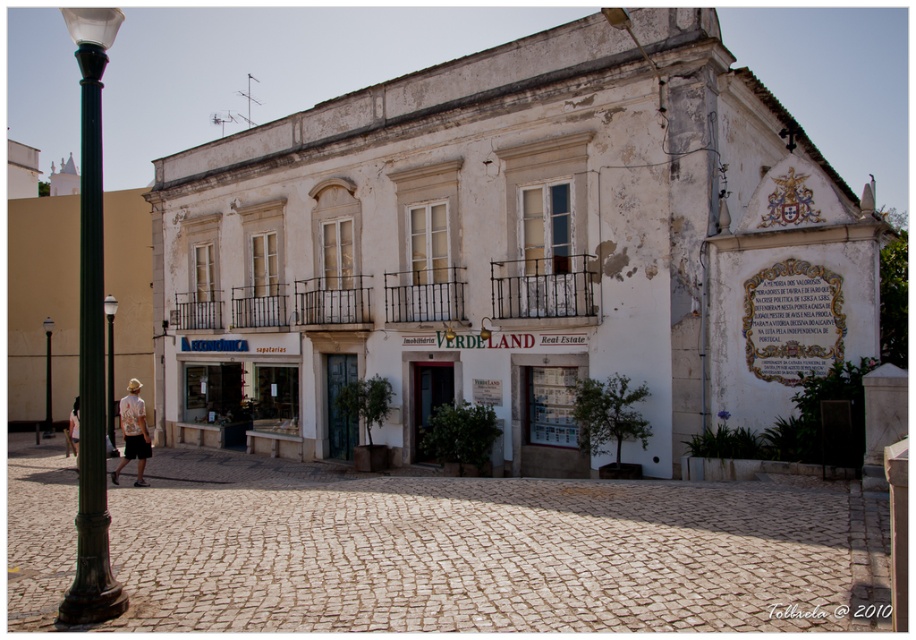
You are a tourist standing in front of the old building and notice two structures at the left side. One is the black glass lamp post at left and the other is the metallic pole at left. Which one is above the other?

The black glass lamp post at left is positioned over the metallic pole at left, so it is above the metallic pole at left.

You are a delivery person trying to secure a package on your bicycle. The package is too tall to fit under the black glass lamp post at left and the metallic pole at left. Which object would you need to avoid hitting your head on when passing underneath?

The black glass lamp post at left has a greater height compared to metallic pole at left, so you should avoid the black glass lamp post at left to prevent hitting your head since it is taller.